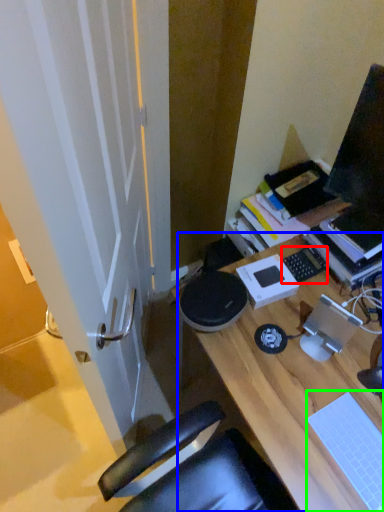
Question: Which is nearer to the laptop keyboard (highlighted by a red box)? desk (highlighted by a blue box) or laptop keyboard (highlighted by a green box).

Choices:
 (A) desk
 (B) laptop keyboard

Answer: (A)